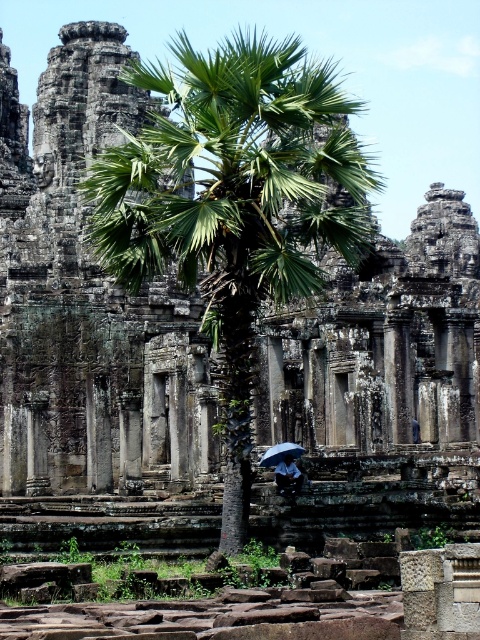
Question: In this image, where is dark blue fabric umbrella at center located relative to transparent plastic umbrella at center?

Choices:
 (A) above
 (B) below

Answer: (B)

Question: Which point is closer to the camera?

Choices:
 (A) (263, 454)
 (B) (289, 474)

Answer: (B)

Question: Is dark blue fabric umbrella at center closer to camera compared to transparent plastic umbrella at center?

Choices:
 (A) yes
 (B) no

Answer: (A)

Question: Is dark blue fabric umbrella at center to the left of transparent plastic umbrella at center from the viewer's perspective?

Choices:
 (A) no
 (B) yes

Answer: (A)

Question: Which of the following is the closest to the observer?

Choices:
 (A) (271, 449)
 (B) (280, 474)

Answer: (B)